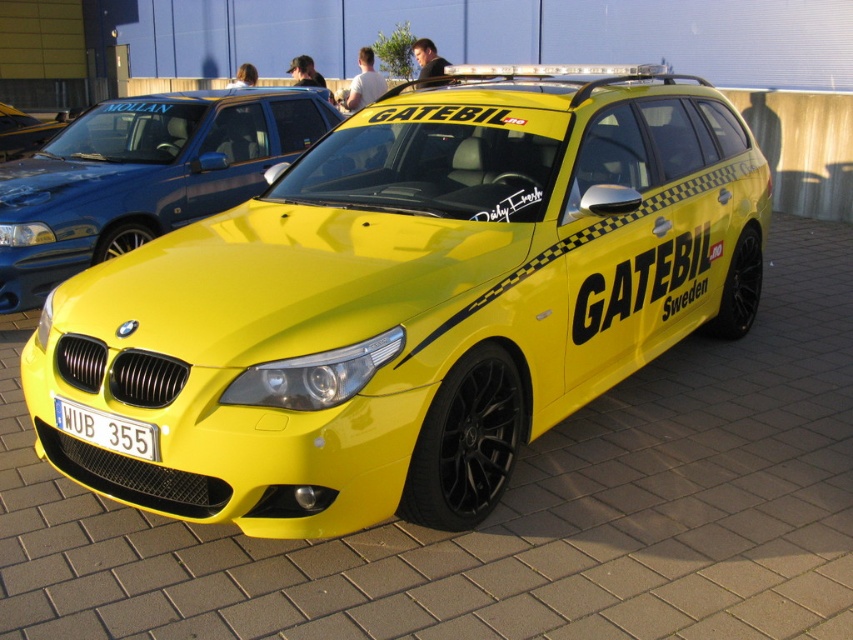
You are a photographer standing in front of the glossy yellow car at center and the yellow glossy car at center. Which car should you focus on to capture the one that is closer to you?

The glossy yellow car at center is closer to the viewer than the yellow glossy car at center, so you should focus on the glossy yellow car at center to capture the one that is closer to you.

You are standing in front of the bright yellow BMW station wagon at the car exhibition. You notice two points marked on the car. The first point is at coordinates point (448, 163) and the second point is at coordinates point (86, 163). From your perspective, which point is closer to you?

Point (448, 163) is in front of point (86, 163), so the first point is closer to you.